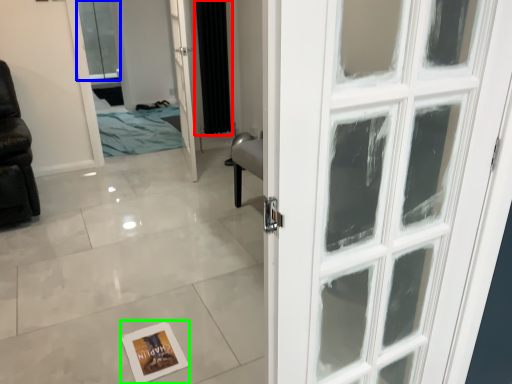
Question: Based on their relative distances, which object is farther from curtain (highlighted by a red box)? Choose from window (highlighted by a blue box) and postcard (highlighted by a green box).

Choices:
 (A) window
 (B) postcard

Answer: (A)